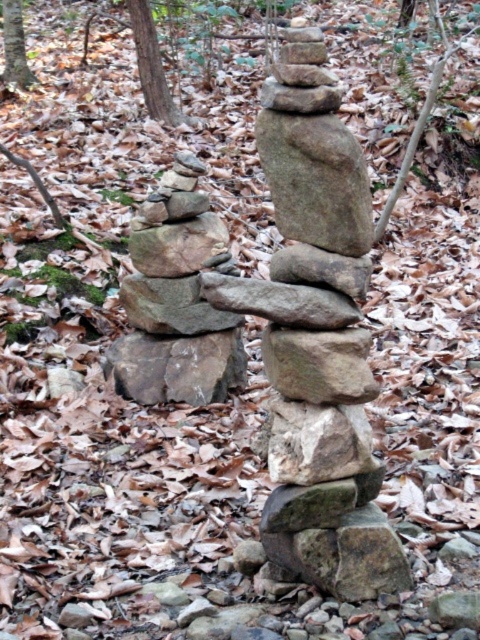
Question: Among these objects, which one is nearest to the camera?

Choices:
 (A) rough textured rock at center
 (B) smooth gray rock at center
 (C) natural stone stack at center

Answer: (C)

Question: Which is farther from the rough textured rock at center?

Choices:
 (A) rustic stone stack at left
 (B) natural stone stack at center
 (C) smooth gray rock at center

Answer: (B)

Question: Is rustic stone stack at left bigger than smooth gray rock at center?

Choices:
 (A) yes
 (B) no

Answer: (A)

Question: Can you confirm if rough textured rock at center is positioned above smooth gray rock at center?

Choices:
 (A) yes
 (B) no

Answer: (B)

Question: Is the position of natural stone stack at center less distant than that of rough textured rock at center?

Choices:
 (A) yes
 (B) no

Answer: (A)

Question: Which of these objects is positioned farthest from the rustic stone stack at left?

Choices:
 (A) rough textured rock at center
 (B) natural stone stack at center
 (C) smooth gray rock at center

Answer: (C)